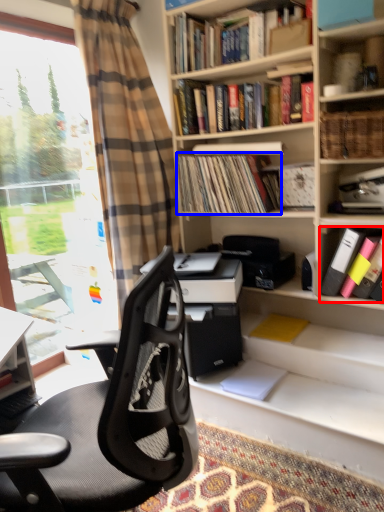
Question: Which point is closer to the camera, book (highlighted by a red box) or book (highlighted by a blue box)?

Choices:
 (A) book
 (B) book

Answer: (A)